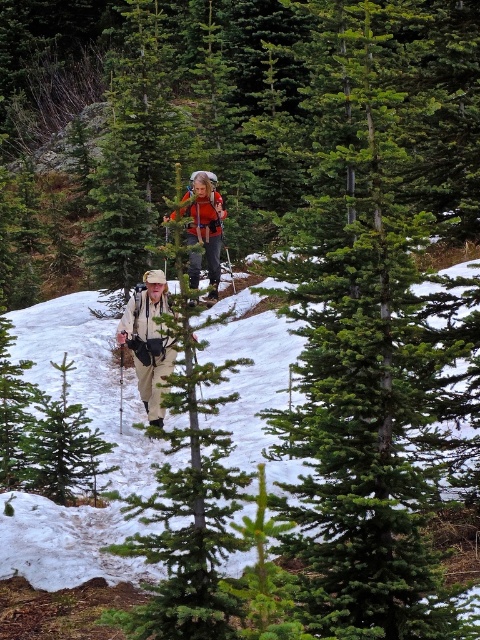
Is khaki fabric backpack at center taller than orange fabric backpack at center?

No, khaki fabric backpack at center is not taller than orange fabric backpack at center.

Which is in front, point (139, 362) or point (192, 257)?

Point (139, 362) is more forward.

Locate an element on the screen. The height and width of the screenshot is (640, 480). khaki fabric backpack at center is located at coordinates (148, 340).

Does green evergreen tree at center have a lesser width compared to orange fabric backpack at center?

Yes.

Looking at this image, who is more forward, (x=420, y=593) or (x=192, y=230)?

Point (x=420, y=593) is in front.

Is point (453, 605) more distant than point (217, 192)?

No, it is in front of (217, 192).

Identify the location of green evergreen tree at center. This screenshot has height=640, width=480. (359, 356).

Is point (347, 422) farther from viewer compared to point (152, 422)?

No, (347, 422) is in front of (152, 422).

Is green evergreen tree at center further to the viewer compared to khaki fabric backpack at center?

No, it is in front of khaki fabric backpack at center.

Who is more distant from viewer, (x=375, y=467) or (x=119, y=339)?

The point (x=119, y=339) is behind.

The image size is (480, 640). In order to click on green evergreen tree at center in this screenshot , I will do `click(359, 356)`.